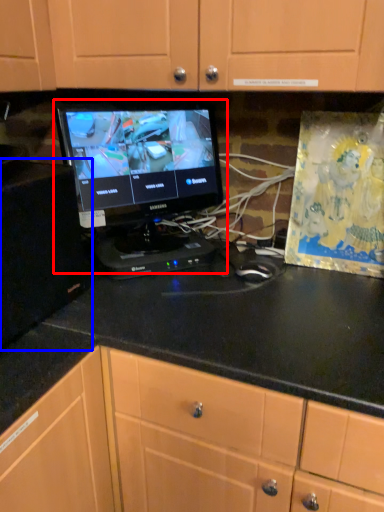
Question: Which point is closer to the camera, computer monitor (highlighted by a red box) or cabinetry (highlighted by a blue box)?

Choices:
 (A) computer monitor
 (B) cabinetry

Answer: (B)